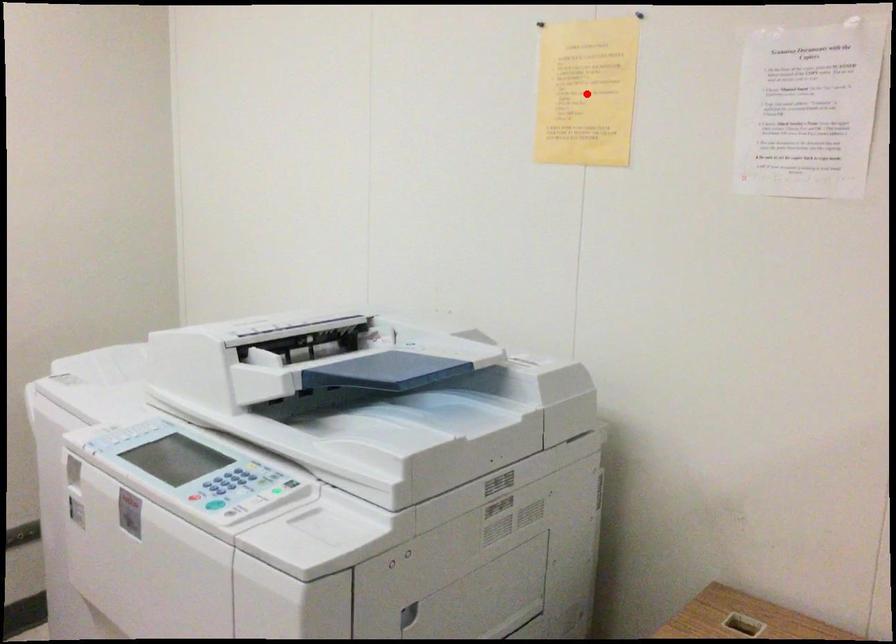
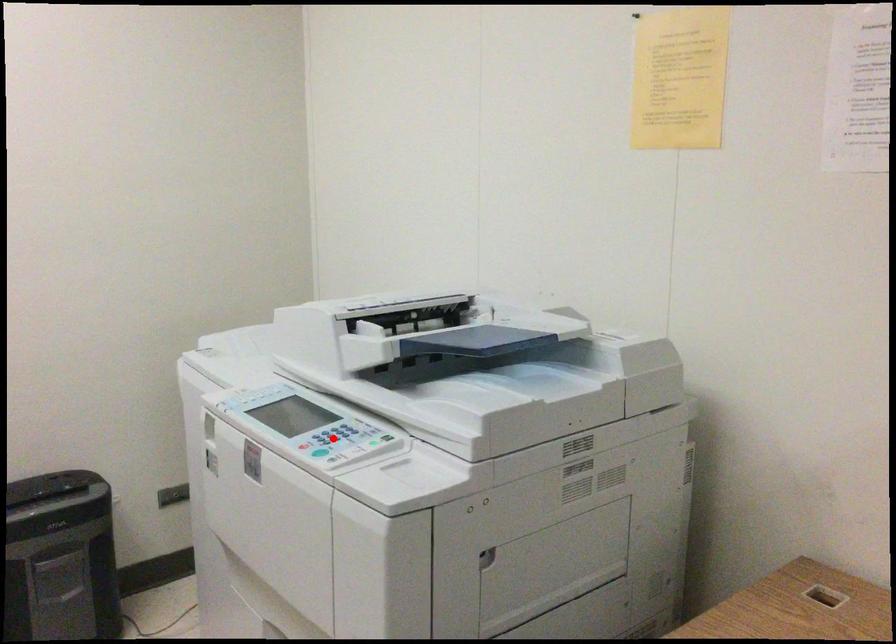
I am providing you with two images of the same scene from different viewpoints. A red point is marked on the first image and another point is marked on the second image. Do the highlighted points in image1 and image2 indicate the same real-world spot?

No